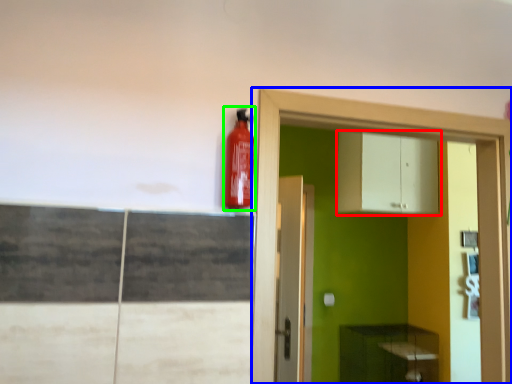
Question: Which is farther away from cabinetry (highlighted by a red box)? dresser (highlighted by a blue box) or extinguisher (highlighted by a green box)?

Choices:
 (A) dresser
 (B) extinguisher

Answer: (B)